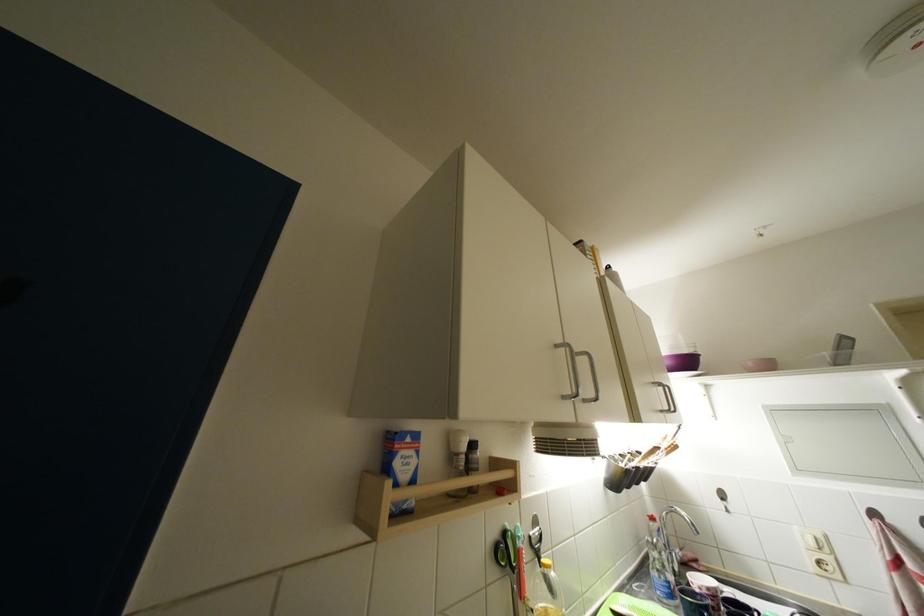
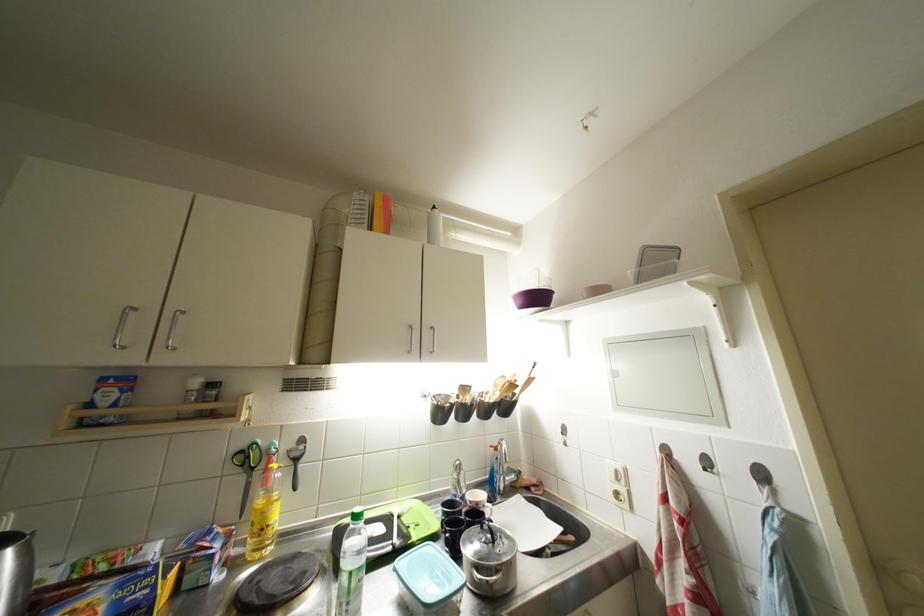
The point at (x=675, y=367) is marked in the first image. Where is the corresponding point in the second image?

(527, 306)